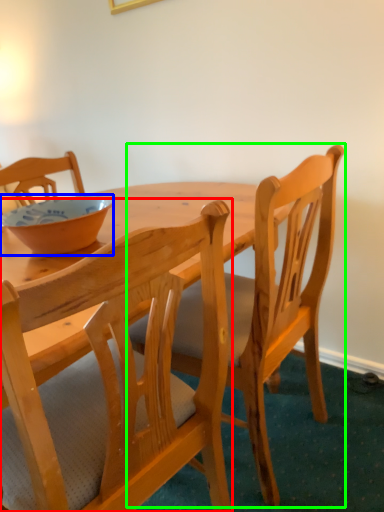
Question: Which is farther away from chair (highlighted by a red box)? bowl (highlighted by a blue box) or chair (highlighted by a green box)?

Choices:
 (A) bowl
 (B) chair

Answer: (A)